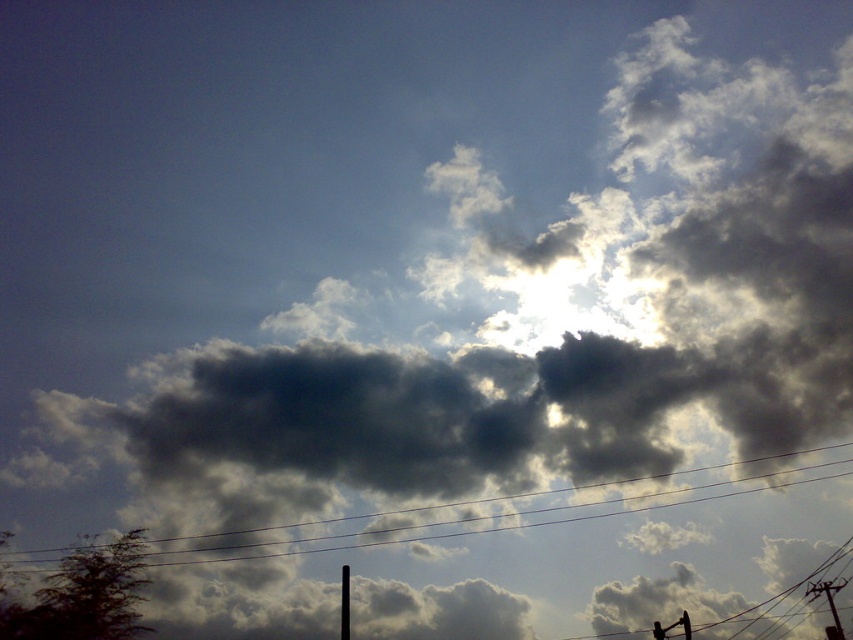
You are an electrician assessing the scene. You need to replace the thinner of the two objects between the black wire at center and the black metallic pole at lower center. Which object should you replace?

The black wire at center is wider than the black metallic pole at lower center. Therefore, the thinner object is the black metallic pole at lower center, which should be replaced.

You are a bird flying towards the black wire at center and the black metallic pole at lower center. Which object will you encounter first?

The black metallic pole at lower center is shorter than the black wire at center, so you will encounter the black metallic pole at lower center first because it is closer to you.

You are a bird flying in the sky scene. You see the black wire at center and the black metallic pole at lower center. Which object is higher from the ground?

The black wire at center is located above the black metallic pole at lower center, so the black wire at center is higher from the ground.